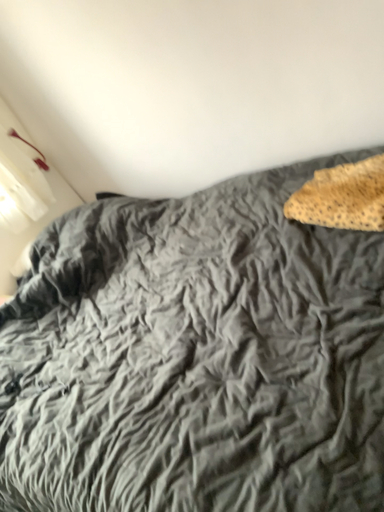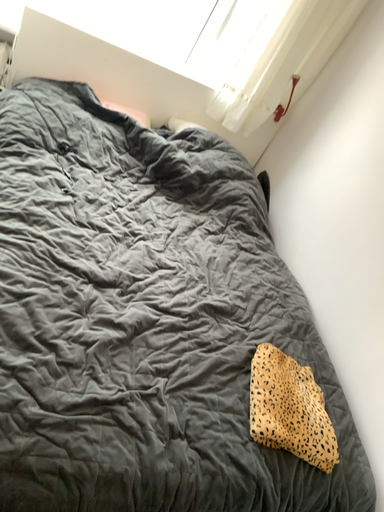
Question: Which way did the camera rotate in the video?

Choices:
 (A) rotated left
 (B) rotated right

Answer: (A)